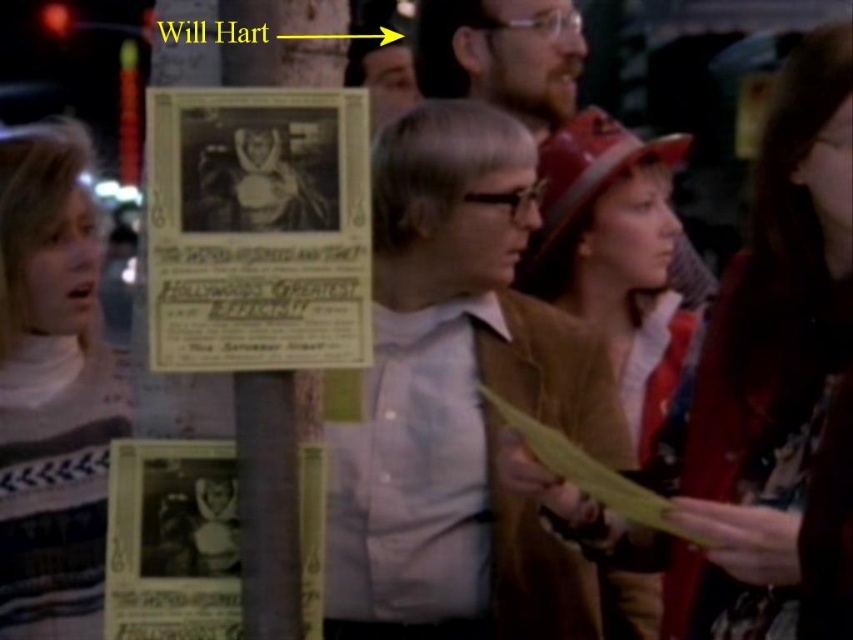
You are designing a poster for a movie scene featuring the striped sweater at left and brown suede hat at center. Which object should you make larger to emphasize the main character?

The brown suede hat at center should be made larger because it occupies more space than the striped sweater at left, indicating it is more important in the scene.